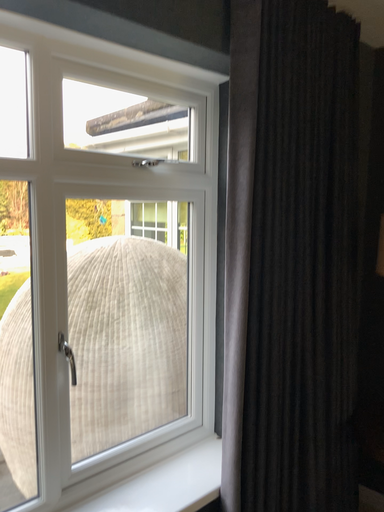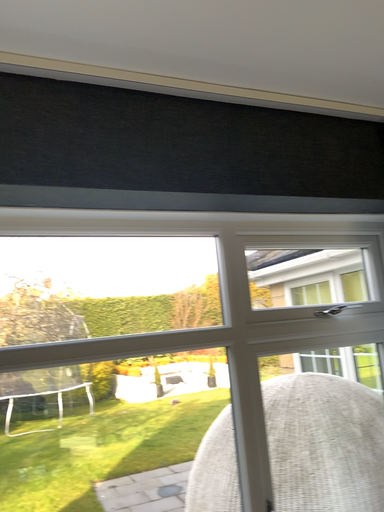
Question: How did the camera likely rotate when shooting the video?

Choices:
 (A) rotated right
 (B) rotated left

Answer: (B)